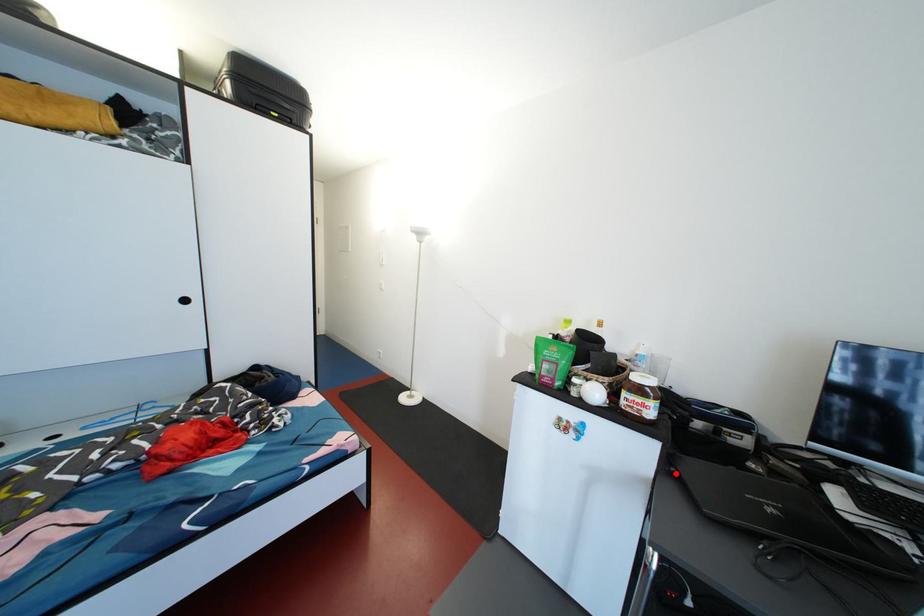
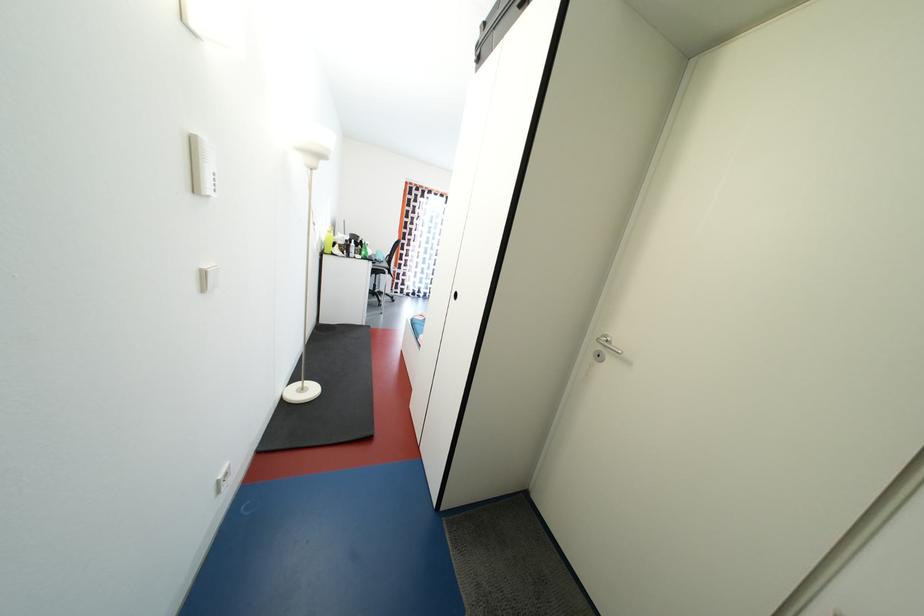
Question: I am providing you with two images of the same scene from different viewpoints. A red point is marked on the first image. At the location where the point appears in image 1, is it still visible in image 2?

Choices:
 (A) Yes
 (B) No

Answer: (B)